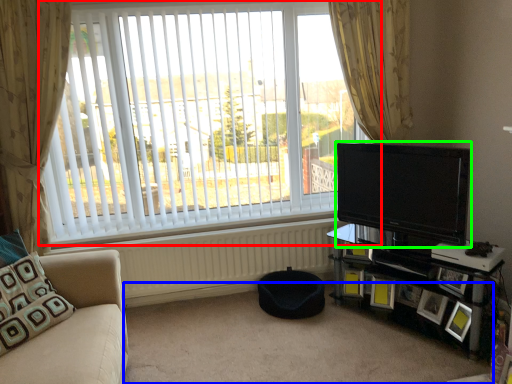
Question: Considering the real-world distances, which object is farthest from window (highlighted by a red box)? plain (highlighted by a blue box) or television (highlighted by a green box)?

Choices:
 (A) plain
 (B) television

Answer: (A)